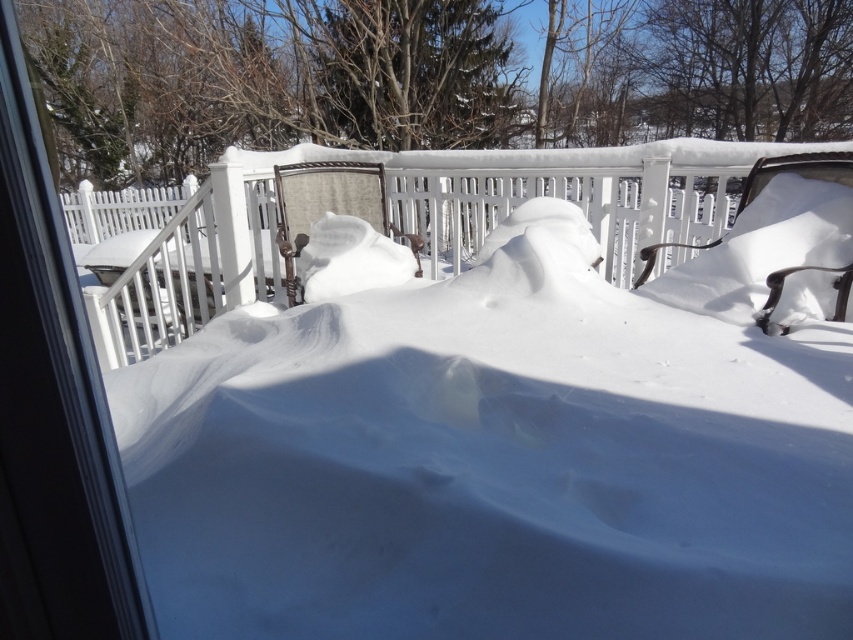
Consider the image. You are standing inside a building and looking out through the transparent plastic screen door at left. Can you see the white wood fence at center from your current position?

The transparent plastic screen door at left is behind white wood fence at center, so you cannot see the white wood fence at center through the door because the fence is blocking the view.